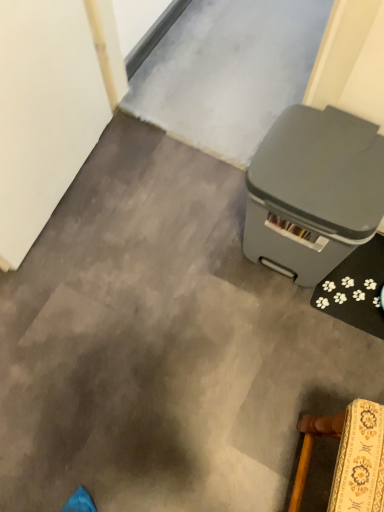
Question: Is wooden upholstered chair at lower right further to the viewer compared to gray plastic waste bin at right?

Choices:
 (A) no
 (B) yes

Answer: (A)

Question: From the image's perspective, is wooden upholstered chair at lower right on top of gray plastic waste bin at right?

Choices:
 (A) yes
 (B) no

Answer: (B)

Question: Is gray plastic waste bin at right inside wooden upholstered chair at lower right?

Choices:
 (A) yes
 (B) no

Answer: (B)

Question: Is wooden upholstered chair at lower right oriented towards gray plastic waste bin at right?

Choices:
 (A) no
 (B) yes

Answer: (A)

Question: Is wooden upholstered chair at lower right oriented away from gray plastic waste bin at right?

Choices:
 (A) no
 (B) yes

Answer: (A)

Question: Is wooden upholstered chair at lower right far away from gray plastic waste bin at right?

Choices:
 (A) yes
 (B) no

Answer: (B)

Question: From a real-world perspective, is gray plastic waste bin at right beneath wooden upholstered chair at lower right?

Choices:
 (A) no
 (B) yes

Answer: (B)

Question: Considering the relative sizes of gray plastic waste bin at right and wooden upholstered chair at lower right in the image provided, is gray plastic waste bin at right wider than wooden upholstered chair at lower right?

Choices:
 (A) no
 (B) yes

Answer: (B)

Question: Is the position of gray plastic waste bin at right less distant than that of wooden upholstered chair at lower right?

Choices:
 (A) no
 (B) yes

Answer: (A)

Question: Is wooden upholstered chair at lower right at the back of gray plastic waste bin at right?

Choices:
 (A) no
 (B) yes

Answer: (A)

Question: Does gray plastic waste bin at right appear on the right side of wooden upholstered chair at lower right?

Choices:
 (A) no
 (B) yes

Answer: (A)

Question: Is gray plastic waste bin at right positioned behind wooden upholstered chair at lower right?

Choices:
 (A) no
 (B) yes

Answer: (B)

Question: Visually, is gray plastic waste bin at right positioned to the left or to the right of wooden upholstered chair at lower right?

Choices:
 (A) right
 (B) left

Answer: (B)